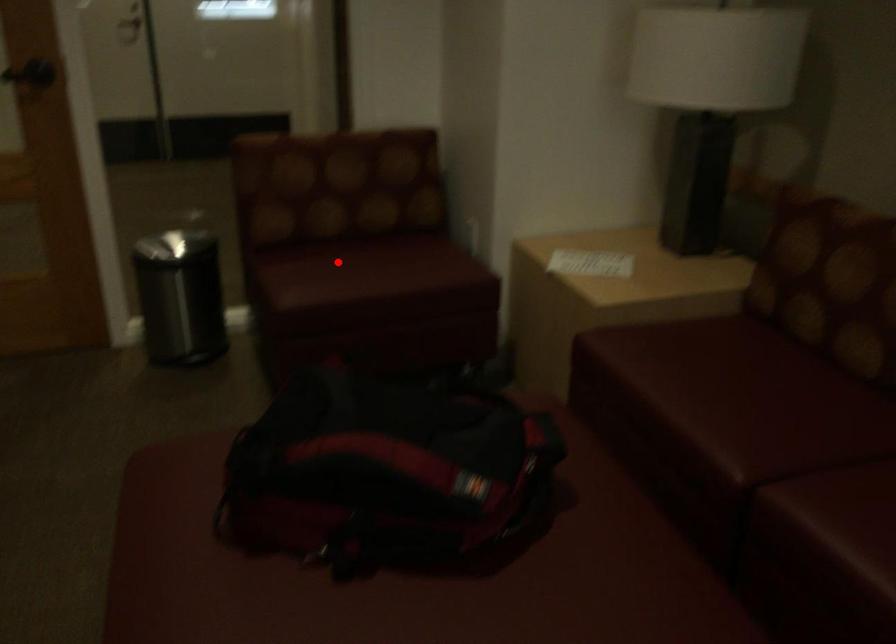
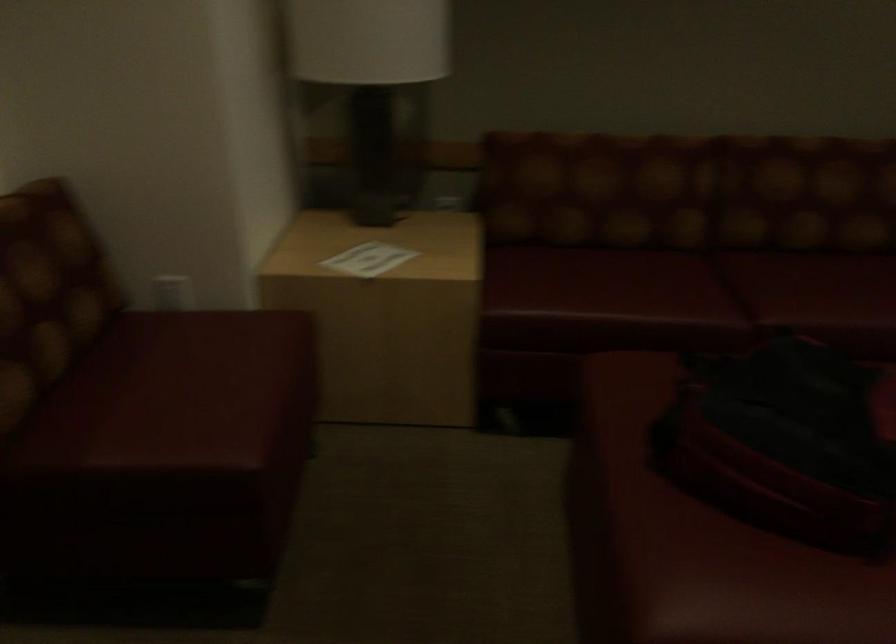
Find the pixel in the second image that matches the highlighted location in the first image.

(175, 393)